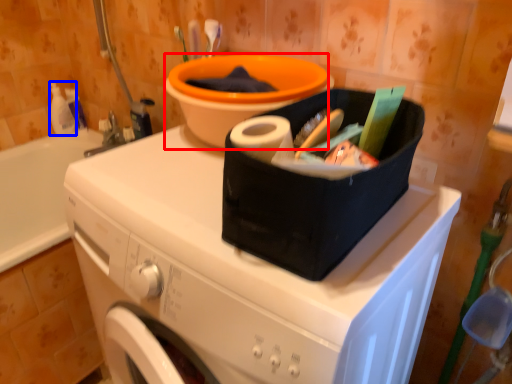
Question: Among these objects, which one is farthest to the camera, basin (highlighted by a red box) or cleaning product (highlighted by a blue box)?

Choices:
 (A) basin
 (B) cleaning product

Answer: (B)